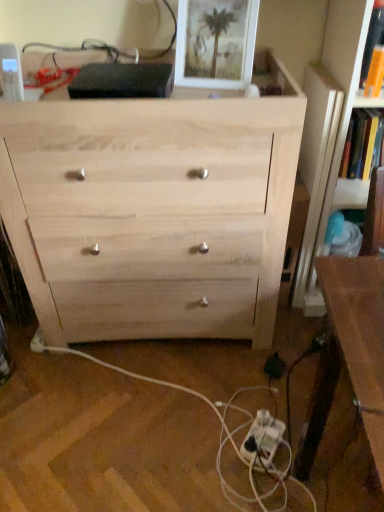
What are the coordinates of `wooden floor at lower center` in the screenshot? It's located at (224, 433).

Measure the distance between point (204, 85) and camera.

The distance of point (204, 85) from camera is 1.24 meters.

Where is `white matte picture frame at upper center`? The width and height of the screenshot is (384, 512). white matte picture frame at upper center is located at coordinates (215, 42).

What are the coordinates of `brown wooden table at right` in the screenshot? It's located at (359, 334).

I want to click on orange paper book at upper right, which appears as the first book when viewed from the front, so click(372, 39).

Which object is thinner, natural wood chest of drawers at center or white matte picture frame at upper center?

white matte picture frame at upper center.

From the image's perspective, which is below, natural wood chest of drawers at center or white matte picture frame at upper center?

natural wood chest of drawers at center is shown below in the image.

Is natural wood chest of drawers at center taller or shorter than white matte picture frame at upper center?

natural wood chest of drawers at center is taller than white matte picture frame at upper center.

How many degrees apart are the facing directions of brown wooden table at right and white matte picture frame at upper center?

14.2 degrees.

In the scene shown: Which object is positioned more to the right, brown wooden table at right or white matte picture frame at upper center?

brown wooden table at right is more to the right.

Measure the distance from brown wooden table at right to white matte picture frame at upper center.

The distance of brown wooden table at right from white matte picture frame at upper center is 30.38 inches.

Is white matte picture frame at upper center inside brown wooden table at right?

No, white matte picture frame at upper center is not a part of brown wooden table at right.

Is white plastic extension cord at lower center at the right side of natural wood chest of drawers at center?

Indeed, white plastic extension cord at lower center is positioned on the right side of natural wood chest of drawers at center.

Considering the sizes of white plastic extension cord at lower center and natural wood chest of drawers at center in the image, is white plastic extension cord at lower center bigger or smaller than natural wood chest of drawers at center?

Clearly, white plastic extension cord at lower center is smaller in size than natural wood chest of drawers at center.

Based on the photo, is white plastic extension cord at lower center further to camera compared to natural wood chest of drawers at center?

Yes.

What's the angular difference between white plastic extension cord at lower center and black plastic electric outlet at lower right's facing directions?

The facing directions of white plastic extension cord at lower center and black plastic electric outlet at lower right are 85.8 degrees apart.

Is white plastic extension cord at lower center taller than black plastic electric outlet at lower right?

Indeed, white plastic extension cord at lower center has a greater height compared to black plastic electric outlet at lower right.

Is white plastic extension cord at lower center positioned before black plastic electric outlet at lower right?

Yes, the depth of white plastic extension cord at lower center is less than that of black plastic electric outlet at lower right.

Does white plastic extension cord at lower center have a larger size compared to black plastic electric outlet at lower right?

Yes, white plastic extension cord at lower center is bigger than black plastic electric outlet at lower right.

Can you see wooden floor at lower center touching brown wooden table at right?

wooden floor at lower center and brown wooden table at right are not in contact.

Considering the positions of objects wooden floor at lower center and brown wooden table at right in the image provided, who is behind, wooden floor at lower center or brown wooden table at right?

wooden floor at lower center is behind.

From the picture: Can you confirm if wooden floor at lower center is thinner than brown wooden table at right?

No.

Between wooden floor at lower center and brown wooden table at right, which one has larger size?

brown wooden table at right.

The height and width of the screenshot is (512, 384). Identify the location of string in front of the hardcover book at upper right, placed as the 1th book when sorted from right to left. (224, 433).

Is hardcover book at upper right, which ranks as the 1th book in back-to-front order, taller than wooden floor at lower center?

Indeed, hardcover book at upper right, which ranks as the 1th book in back-to-front order, has a greater height compared to wooden floor at lower center.

From a real-world perspective, is hardcover book at upper right, the 2th book from the left, beneath wooden floor at lower center?

No.

Is point (375, 115) closer or farther from the camera than point (99, 218)?

Point (375, 115) is positioned farther from the camera compared to point (99, 218).

Is natural wood chest of drawers at center completely or partially inside hardcover book at upper right, placed as the 1th book when sorted from right to left?

No, natural wood chest of drawers at center is not inside hardcover book at upper right, placed as the 1th book when sorted from right to left.

Where is `picture frame that appears behind the natural wood chest of drawers at center`? picture frame that appears behind the natural wood chest of drawers at center is located at coordinates (215, 42).

At what (x,y) coordinates should I click in order to perform the action: click on picture frame above the brown wooden table at right (from a real-world perspective). Please return your answer as a coordinate pair (x, y). The width and height of the screenshot is (384, 512). Looking at the image, I should click on (215, 42).

Looking at this image, considering their positions, is wooden floor at lower center positioned further to white plastic extension cord at lower center than white matte picture frame at upper center?

white matte picture frame at upper center.

Which object lies further to the anchor point natural wood chest of drawers at center, brown wooden table at right or hardcover book at upper right, placed as the 1th book when sorted from right to left?

hardcover book at upper right, placed as the 1th book when sorted from right to left, is positioned further to the anchor natural wood chest of drawers at center.

Based on their spatial positions, is orange paper book at upper right, which appears as the first book when viewed from the front, or hardcover book at upper right, placed as the 1th book when sorted from right to left, closer to white plastic extension cord at lower center?

Based on the image, hardcover book at upper right, placed as the 1th book when sorted from right to left, appears to be nearer to white plastic extension cord at lower center.

Based on their spatial positions, is wooden floor at lower center or natural wood chest of drawers at center closer to orange paper book at upper right, marked as the second book in a right-to-left arrangement?

The object closer to orange paper book at upper right, marked as the second book in a right-to-left arrangement, is natural wood chest of drawers at center.

When comparing their distances from natural wood chest of drawers at center, does white plastic extension cord at lower center or black plastic electric outlet at lower right seem closer?

Among the two, black plastic electric outlet at lower right is located nearer to natural wood chest of drawers at center.

Which object lies further to the anchor point white matte picture frame at upper center, wooden floor at lower center or natural wood chest of drawers at center?

wooden floor at lower center is further to white matte picture frame at upper center.

Which object lies further to the anchor point white plastic extension cord at lower center, orange paper book at upper right, marked as the second book in a right-to-left arrangement, or wooden floor at lower center?

orange paper book at upper right, marked as the second book in a right-to-left arrangement.

When comparing their distances from brown wooden table at right, does black plastic electric outlet at lower right or orange paper book at upper right, acting as the 1th book starting from the left, seem closer?

The object closer to brown wooden table at right is orange paper book at upper right, acting as the 1th book starting from the left.

Locate an element on the screen. The width and height of the screenshot is (384, 512). book between white matte picture frame at upper center and hardcover book at upper right, which ranks as the 1th book in back-to-front order, in the horizontal direction is located at coordinates pos(372,39).

At what (x,y) coordinates should I click in order to perform the action: click on book situated between natural wood chest of drawers at center and hardcover book at upper right, placed as the 1th book when sorted from right to left, from left to right. Please return your answer as a coordinate pair (x, y). The image size is (384, 512). Looking at the image, I should click on (372, 39).

Locate an element on the screen. The height and width of the screenshot is (512, 384). table between orange paper book at upper right, marked as the second book in a right-to-left arrangement, and white plastic extension cord at lower center, in the vertical direction is located at coordinates (359, 334).

Find the location of a particular element. This screenshot has height=512, width=384. the chest of drawers between orange paper book at upper right, acting as the 1th book starting from the left, and black plastic electric outlet at lower right vertically is located at coordinates (152, 212).